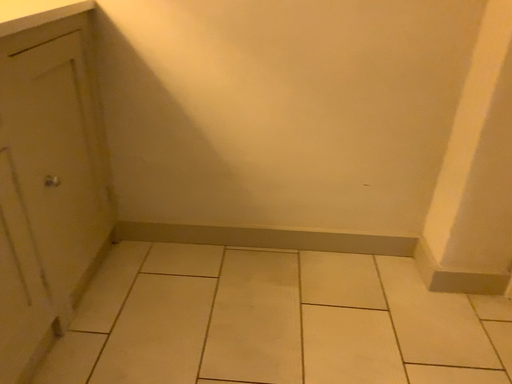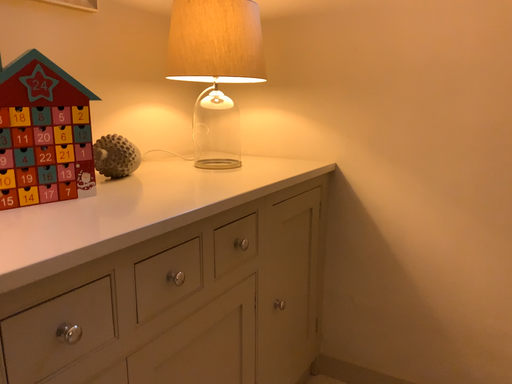
Question: How did the camera likely rotate when shooting the video?

Choices:
 (A) rotated downward
 (B) rotated upward

Answer: (B)